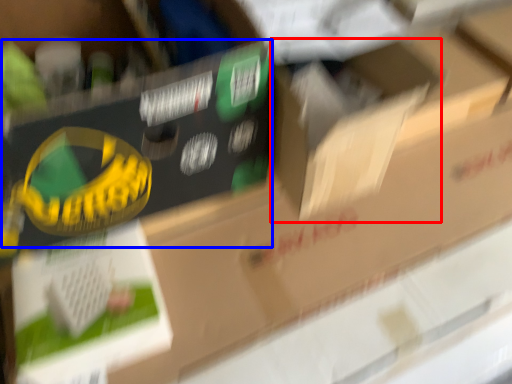
Question: Which object is closer to the camera taking this photo, cardboard box (highlighted by a red box) or storage box (highlighted by a blue box)?

Choices:
 (A) cardboard box
 (B) storage box

Answer: (B)